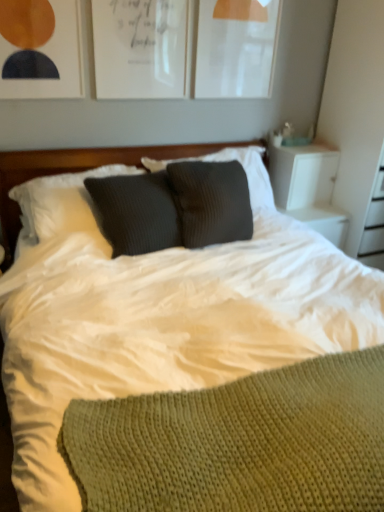
Question: Considering the positions of white soft bedding at center and white paper at upper center, which is the 2th picture frame in left-to-right order, in the image, is white soft bedding at center bigger or smaller than white paper at upper center, which is the 2th picture frame in left-to-right order,?

Choices:
 (A) big
 (B) small

Answer: (A)

Question: From a real-world perspective, is white soft bedding at center above or below white paper at upper center, placed as the 2th picture frame when sorted from right to left?

Choices:
 (A) below
 (B) above

Answer: (A)

Question: Based on their relative distances, which object is farther from the matte white picture frame at upper center, which is the 1th picture frame from right to left?

Choices:
 (A) matte white picture frame at upper left, which is the 1th picture frame in left-to-right order
 (B) white paper at upper center, placed as the 2th picture frame when sorted from right to left
 (C) white soft bedding at center
 (D) woolen dark gray pillow at center

Answer: (C)

Question: Which is nearer to the white soft bedding at center?

Choices:
 (A) woolen dark gray pillow at center
 (B) matte white picture frame at upper left, which ranks as the third picture frame in right-to-left order
 (C) white paper at upper center, which is the 2th picture frame in left-to-right order
 (D) matte white picture frame at upper center, the 3th picture frame viewed from the left

Answer: (A)